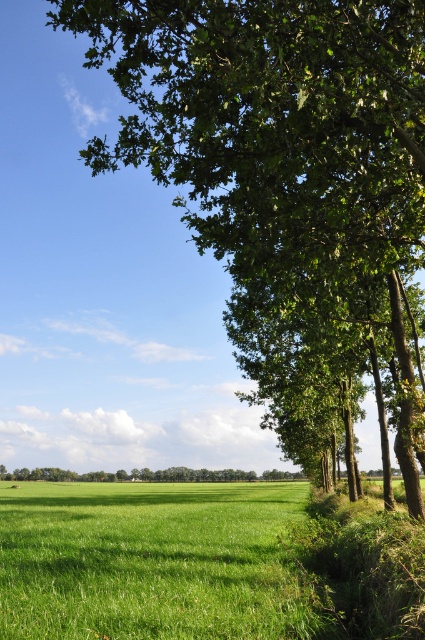
You are standing in the middle of the image and see the green grassy field at lower left and the green leafy tree at lower right. Which object is closer to your feet?

The green leafy tree at lower right is closer to your feet because the green grassy field at lower left is above it, meaning the tree is positioned lower in the scene.

You are a farmer planning to plant a new row of crops between the green leafy tree at upper right and the green leafy tree at lower right. Considering their widths, which tree will require more space between them to accommodate its size?

The green leafy tree at lower right has a greater width compared to the green leafy tree at upper right, so it will require more space between them to accommodate its size.

You are a photographer standing in the middle of the field. You want to take a picture that includes both the green leafy tree at upper right and the green leafy tree at lower right. Which tree should you position closer to the center of your camera frame to ensure both are visible without moving your position?

To include both the green leafy tree at upper right and the green leafy tree at lower right in the frame, you should position the green leafy tree at lower right closer to the center of your camera frame. This is because the green leafy tree at upper right is on the right side of the green leafy tree at lower right, so adjusting focus towards the lower tree will help capture both within the camera view without moving.